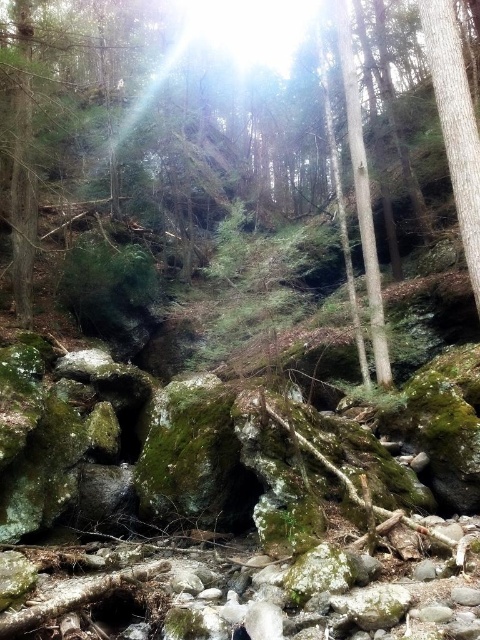
Who is shorter, green mossy rock at center or smooth bark tree at right?

Standing shorter between the two is smooth bark tree at right.

Which is in front, point (107, 65) or point (452, 38)?

Point (452, 38)

Where is `green mossy rock at center`? This screenshot has width=480, height=640. green mossy rock at center is located at coordinates (143, 122).